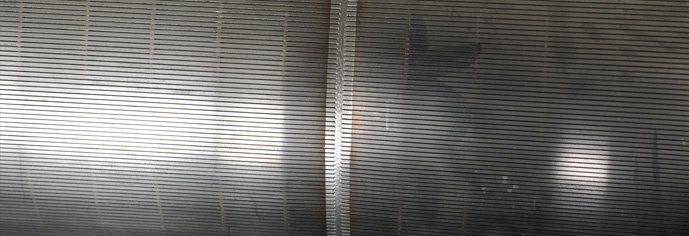
Identify the location of window frame. Image resolution: width=689 pixels, height=236 pixels. (333, 94).